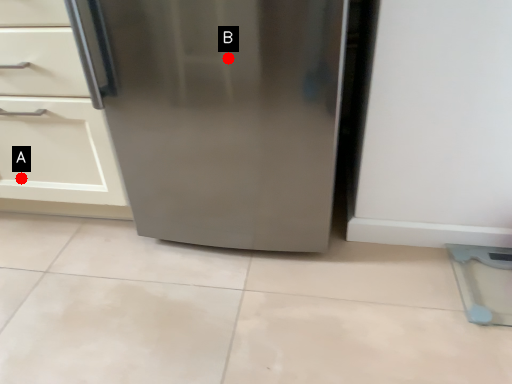
Question: Two points are circled on the image, labeled by A and B beside each circle. Which point is closer to the camera?

Choices:
 (A) A is closer
 (B) B is closer

Answer: (B)